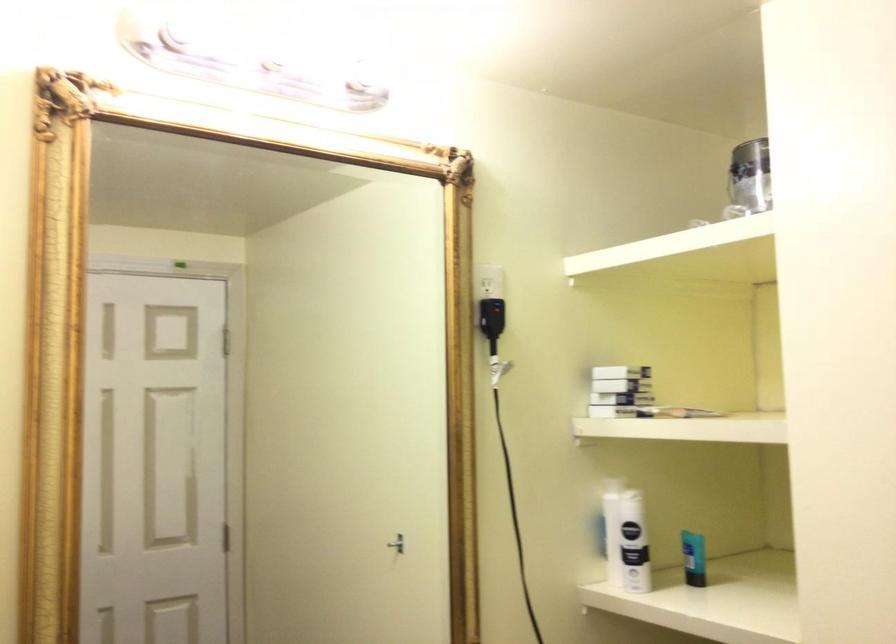
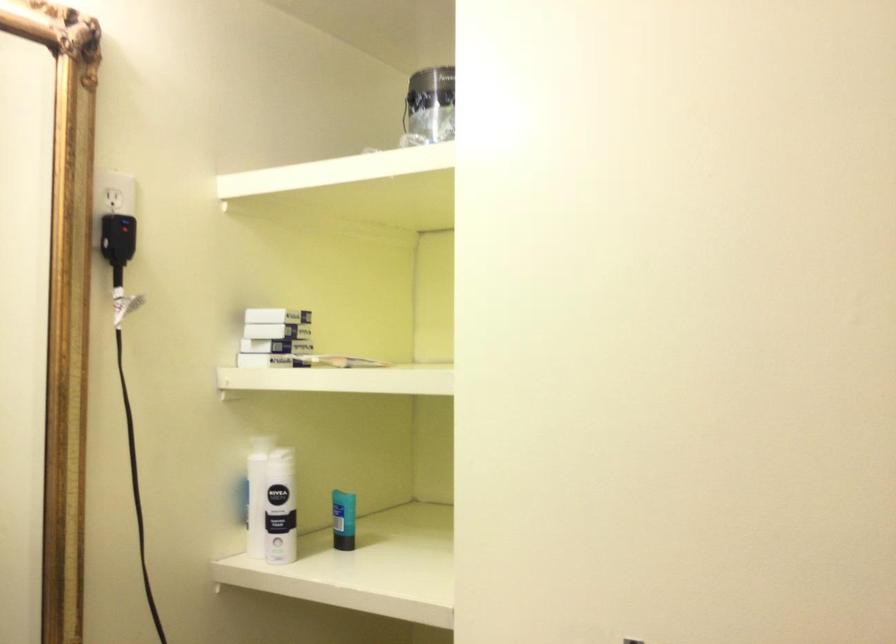
The point at (x=701, y=559) is marked in the first image. Where is the corresponding point in the second image?

(343, 520)